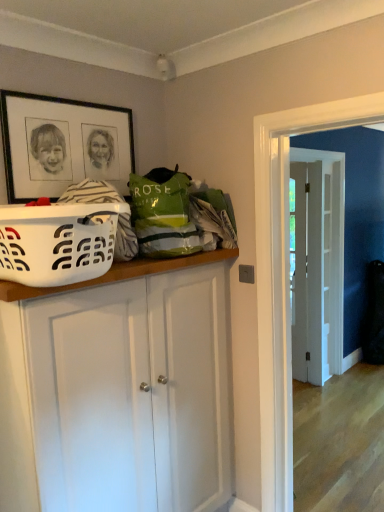
Measure the distance between black matte picture frame at upper left and camera.

black matte picture frame at upper left is 5.35 feet away from camera.

At what (x,y) coordinates should I click in order to perform the action: click on white matte cabinet at center. Please return your answer as a coordinate pair (x, y). The height and width of the screenshot is (512, 384). Looking at the image, I should click on (82, 389).

What do you see at coordinates (58, 242) in the screenshot? The height and width of the screenshot is (512, 384). I see `white plastic laundry basket at left` at bounding box center [58, 242].

This screenshot has height=512, width=384. I want to click on white wooden door at center, so click(x=317, y=262).

Is white wooden door at center in contact with white matte cabinet at center?

No, white wooden door at center is not making contact with white matte cabinet at center.

Locate an element on the screen. door that is above the white matte cabinet at center (from a real-world perspective) is located at coordinates (317, 262).

Considering the sizes of objects white wooden door at center and white matte cabinet at center in the image provided, who is smaller, white wooden door at center or white matte cabinet at center?

With smaller size is white matte cabinet at center.

Is point (309, 298) positioned behind point (34, 466)?

Yes.

From a real-world perspective, is white matte cabinet at center located beneath black matte picture frame at upper left?

Yes, from a real-world perspective, white matte cabinet at center is below black matte picture frame at upper left.

From the image's perspective, which one is positioned higher, white matte cabinet at center or black matte picture frame at upper left?

black matte picture frame at upper left.

Are white matte cabinet at center and black matte picture frame at upper left beside each other?

No, white matte cabinet at center is not touching black matte picture frame at upper left.

Could you tell me if white matte cabinet at center is turned towards black matte picture frame at upper left?

No, white matte cabinet at center does not turn towards black matte picture frame at upper left.

Which is behind, black matte picture frame at upper left or white wooden door at center?

white wooden door at center is further away from the camera.

From a real-world perspective, which object rests below the other?

white wooden door at center, from a real-world perspective.

Would you say black matte picture frame at upper left contains white wooden door at center?

No, white wooden door at center is not inside black matte picture frame at upper left.

Is white matte cabinet at center bigger or smaller than white wooden door at center?

white matte cabinet at center is smaller than white wooden door at center.

Can you confirm if white matte cabinet at center is positioned to the right of white wooden door at center?

No, white matte cabinet at center is not to the right of white wooden door at center.

Is point (19, 294) farther from viewer compared to point (340, 347)?

That is False.

From a real-world perspective, is white matte cabinet at center physically below white wooden door at center?

Yes.

What's the angular difference between white plastic laundry basket at left and black matte picture frame at upper left's facing directions?

white plastic laundry basket at left and black matte picture frame at upper left are facing 0.0057 degrees away from each other.

Considering the points (45, 258) and (107, 130), which point is behind, point (45, 258) or point (107, 130)?

The point (107, 130) is farther.

There is a white plastic laundry basket at left. What are the coordinates of `picture frame above it (from a real-world perspective)` in the screenshot? It's located at (62, 144).

Visually, is white plastic laundry basket at left positioned to the left or to the right of black matte picture frame at upper left?

white plastic laundry basket at left is to the right of black matte picture frame at upper left.

Is white plastic laundry basket at left inside or outside of white matte cabinet at center?

white plastic laundry basket at left lies outside white matte cabinet at center.

Can you tell me how much white plastic laundry basket at left and white matte cabinet at center differ in facing direction?

The angle between the facing direction of white plastic laundry basket at left and the facing direction of white matte cabinet at center is 0.000674 degrees.

From the image's perspective, is white plastic laundry basket at left located above or below white matte cabinet at center?

From the image's perspective, white plastic laundry basket at left appears above white matte cabinet at center.

Between white plastic laundry basket at left and white matte cabinet at center, which one has more height?

white matte cabinet at center is taller.

Who is bigger, white plastic laundry basket at left or white wooden door at center?

white wooden door at center.

The width and height of the screenshot is (384, 512). Identify the location of basket above the white wooden door at center (from the image's perspective). (58, 242).

Which is behind, point (24, 272) or point (315, 282)?

The point (315, 282) is more distant.

Locate an element on the screen. The width and height of the screenshot is (384, 512). cabinetry in front of the white wooden door at center is located at coordinates 82,389.

At what (x,y) coordinates should I click in order to perform the action: click on picture frame that is above the white matte cabinet at center (from a real-world perspective). Please return your answer as a coordinate pair (x, y). The height and width of the screenshot is (512, 384). Looking at the image, I should click on (62, 144).

Estimate the real-world distances between objects in this image. Which object is closer to white matte cabinet at center, white plastic laundry basket at left or white wooden door at center?

white plastic laundry basket at left is closer to white matte cabinet at center.

Which object lies further to the anchor point white wooden door at center, white matte cabinet at center or black matte picture frame at upper left?

Based on the image, black matte picture frame at upper left appears to be further to white wooden door at center.

Estimate the real-world distances between objects in this image. Which object is closer to white wooden door at center, white plastic laundry basket at left or white matte cabinet at center?

white matte cabinet at center.

Based on the photo, based on their spatial positions, is white matte cabinet at center or white wooden door at center further from white plastic laundry basket at left?

white wooden door at center.

Considering their positions, is white wooden door at center positioned closer to white plastic laundry basket at left than white matte cabinet at center?

white matte cabinet at center lies closer to white plastic laundry basket at left than the other object.

From the image, which object appears to be farther from white plastic laundry basket at left, black matte picture frame at upper left or white matte cabinet at center?

The object further to white plastic laundry basket at left is black matte picture frame at upper left.

From the image, which object appears to be farther from white wooden door at center, white plastic laundry basket at left or black matte picture frame at upper left?

white plastic laundry basket at left.

Looking at the image, which one is located closer to white matte cabinet at center, black matte picture frame at upper left or white plastic laundry basket at left?

white plastic laundry basket at left.

This screenshot has height=512, width=384. Find the location of `basket between black matte picture frame at upper left and white matte cabinet at center vertically`. basket between black matte picture frame at upper left and white matte cabinet at center vertically is located at coordinates (58, 242).

This screenshot has height=512, width=384. Find the location of `cabinetry located between white plastic laundry basket at left and white wooden door at center in the depth direction`. cabinetry located between white plastic laundry basket at left and white wooden door at center in the depth direction is located at coordinates (82, 389).

The image size is (384, 512). I want to click on picture frame located between white matte cabinet at center and white wooden door at center in the depth direction, so click(62, 144).

Locate an element on the screen. The width and height of the screenshot is (384, 512). picture frame positioned between white plastic laundry basket at left and white wooden door at center from near to far is located at coordinates (62, 144).